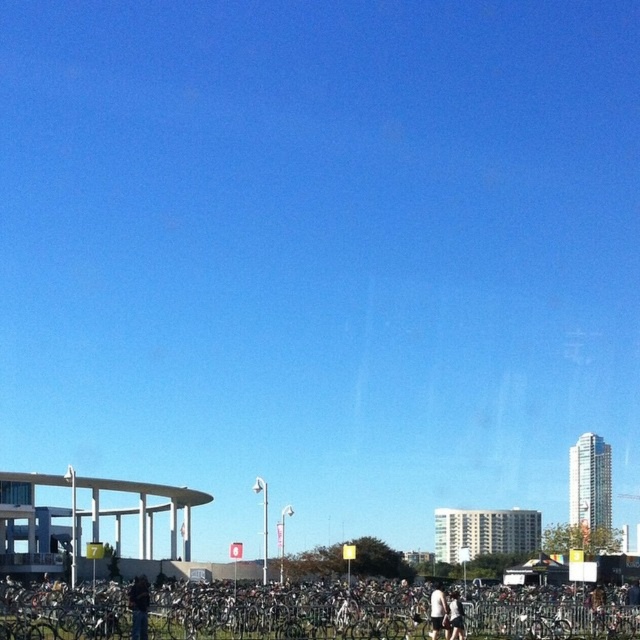
Question: Observing the image, what is the correct spatial positioning of dark brown leather jacket at lower center in reference to white matte shirt at lower center?

Choices:
 (A) above
 (B) below

Answer: (B)

Question: Based on their relative distances, which object is farther from the white matte shirt at lower center?

Choices:
 (A) silver metallic bicycle at center
 (B) white cotton shorts at lower center

Answer: (A)

Question: Can you confirm if silver metallic bicycle at center is positioned below white matte shirt at lower center?

Choices:
 (A) yes
 (B) no

Answer: (A)

Question: Which is farther from the white cotton shorts at lower center?

Choices:
 (A) dark brown leather jacket at lower center
 (B) white matte shirt at lower center
 (C) silver metallic bicycle at center

Answer: (A)

Question: Is silver metallic bicycle at center thinner than dark brown leather jacket at lower center?

Choices:
 (A) yes
 (B) no

Answer: (B)

Question: Which of the following is the farthest from the observer?

Choices:
 (A) silver metallic bicycle at center
 (B) dark brown leather jacket at lower center
 (C) white matte shirt at lower center

Answer: (C)